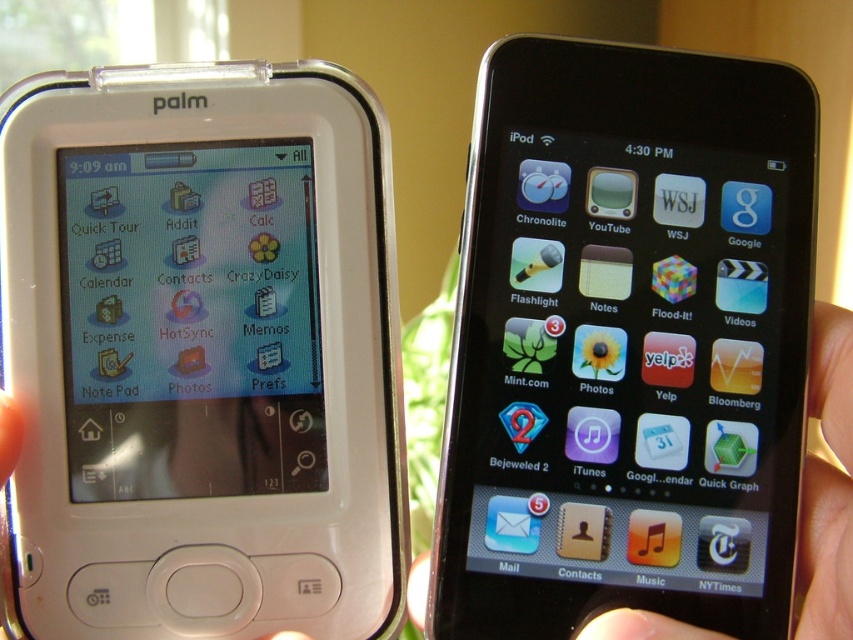
Question: Does white plastic ipod at left come behind black glossy ipod at upper right?

Choices:
 (A) no
 (B) yes

Answer: (B)

Question: Which of the following is the closest to the observer?

Choices:
 (A) black glossy ipod at upper right
 (B) skinsmoothhand at right
 (C) white plastic ipod at left

Answer: (B)

Question: Which of the following is the closest to the observer?

Choices:
 (A) black glossy ipod at upper right
 (B) white plastic ipod at left
 (C) skinsmoothhand at right

Answer: (C)

Question: Which of the following is the closest to the observer?

Choices:
 (A) black glossy ipod at upper right
 (B) white plastic ipod at left
 (C) skinsmoothhand at right

Answer: (C)

Question: Where is white plastic ipod at left located in relation to black glossy ipod at upper right in the image?

Choices:
 (A) below
 (B) above

Answer: (A)

Question: Where is white plastic ipod at left located in relation to black glossy ipod at upper right in the image?

Choices:
 (A) left
 (B) right

Answer: (A)